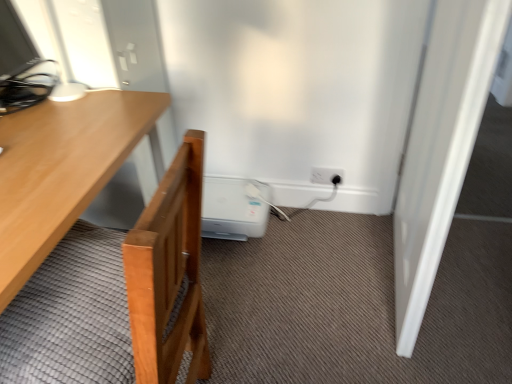
Image resolution: width=512 pixels, height=384 pixels. I want to click on vacant area that is in front of white plastic water heater at lower center, so click(246, 276).